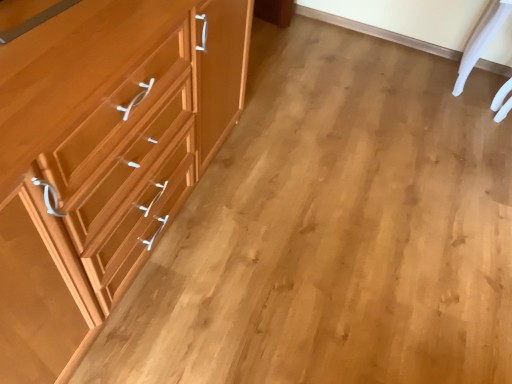
Describe the element at coordinates (103, 157) in the screenshot. I see `matte wood chest of drawers at left` at that location.

Locate an element on the screen. The height and width of the screenshot is (384, 512). matte wood chest of drawers at left is located at coordinates (103, 157).

You are a GUI agent. You are given a task and a screenshot of the screen. Output one action in this format:
    pyautogui.click(x=<x>, y=<y>)
    Task: Click on the matte wood chest of drawers at left
    Image resolution: width=512 pixels, height=384 pixels.
    Given the screenshot: What is the action you would take?
    pyautogui.click(x=103, y=157)